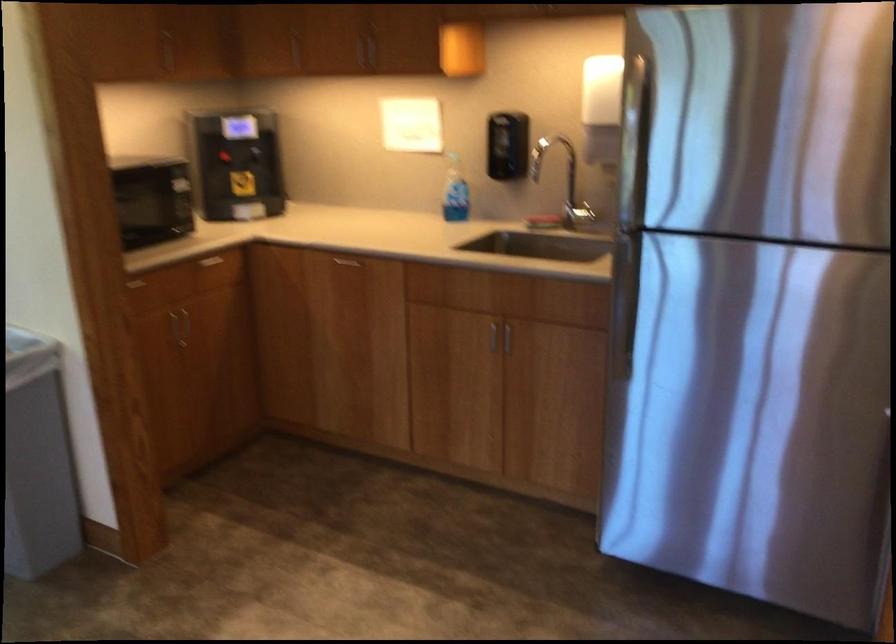
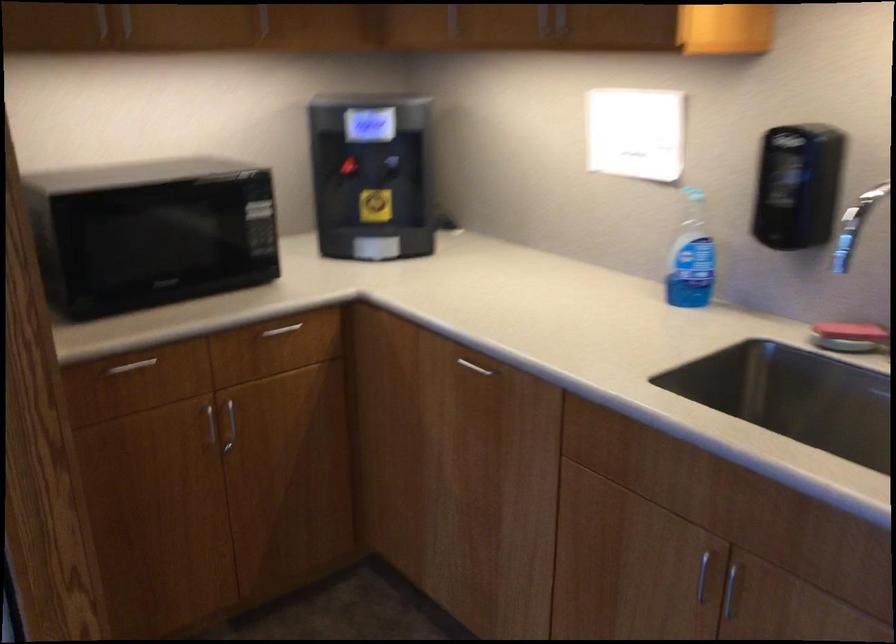
Find the pixel in the second image that matches [547,216] in the first image.

(848, 337)